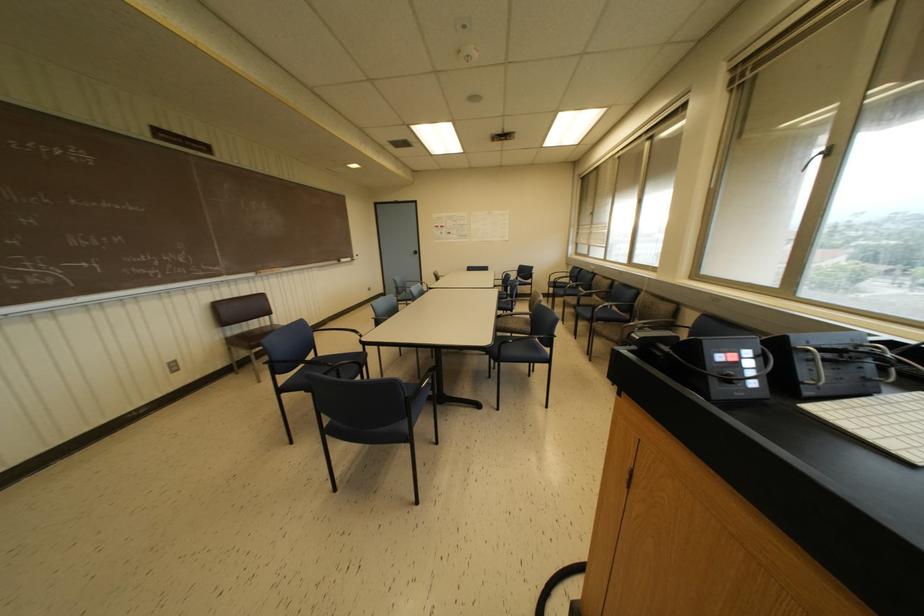
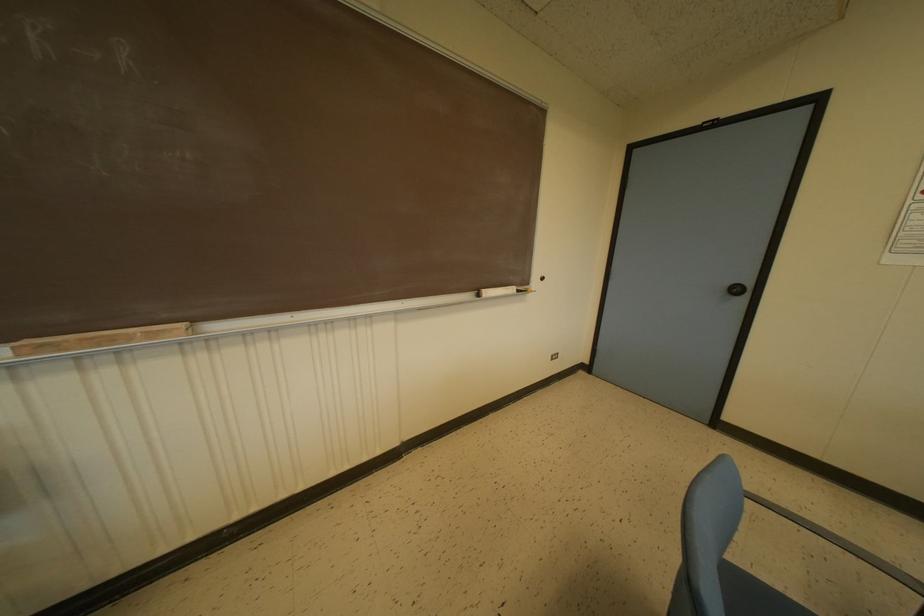
Find the pixel in the second image that matches (417,252) in the first image.

(746, 291)